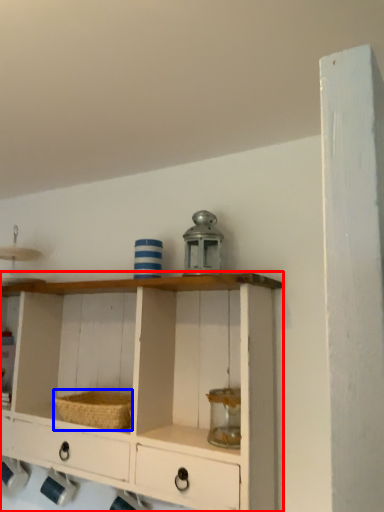
Question: Which object is further to the camera taking this photo, shelf (highlighted by a red box) or basket (highlighted by a blue box)?

Choices:
 (A) shelf
 (B) basket

Answer: (B)